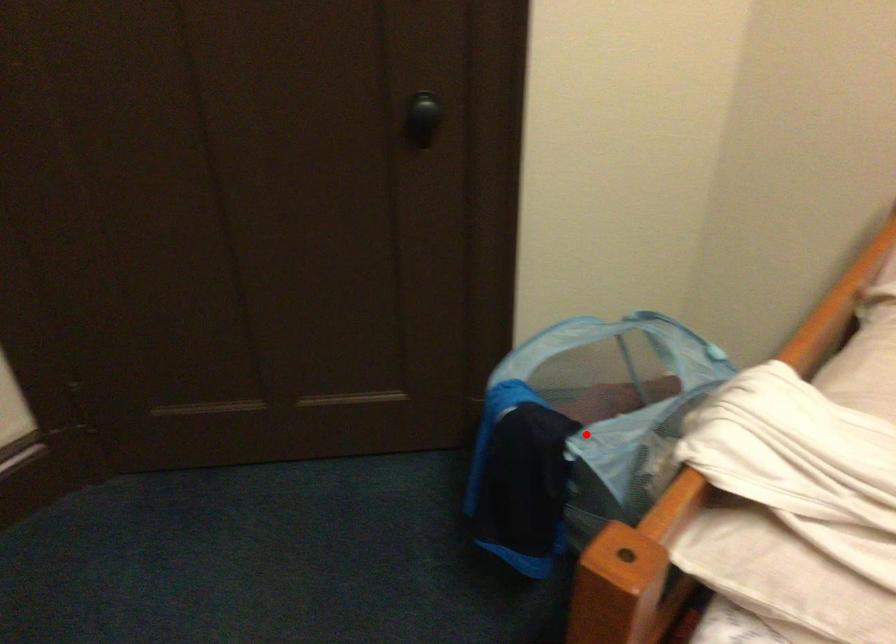
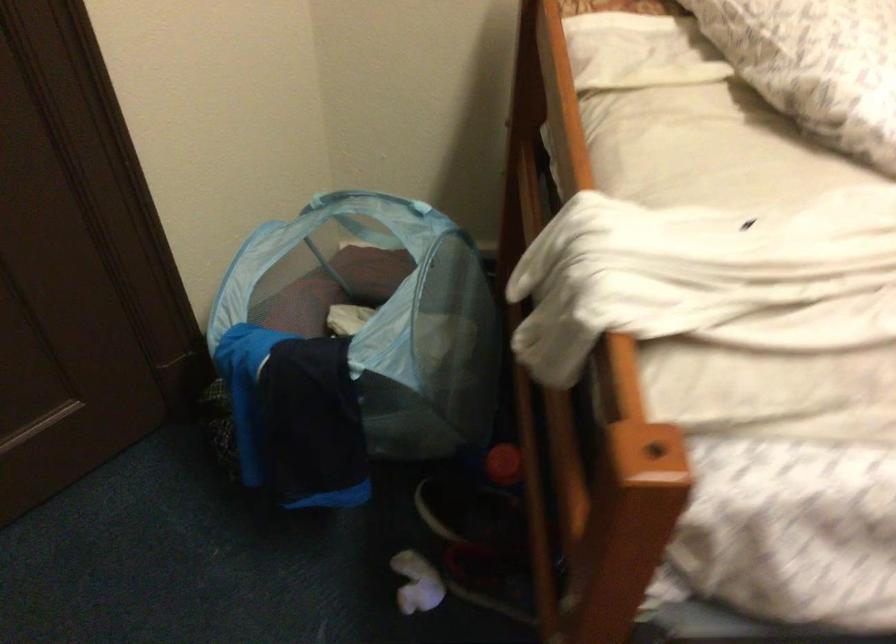
Locate, in the second image, the point that corresponds to the highlighted location in the first image.

(354, 345)